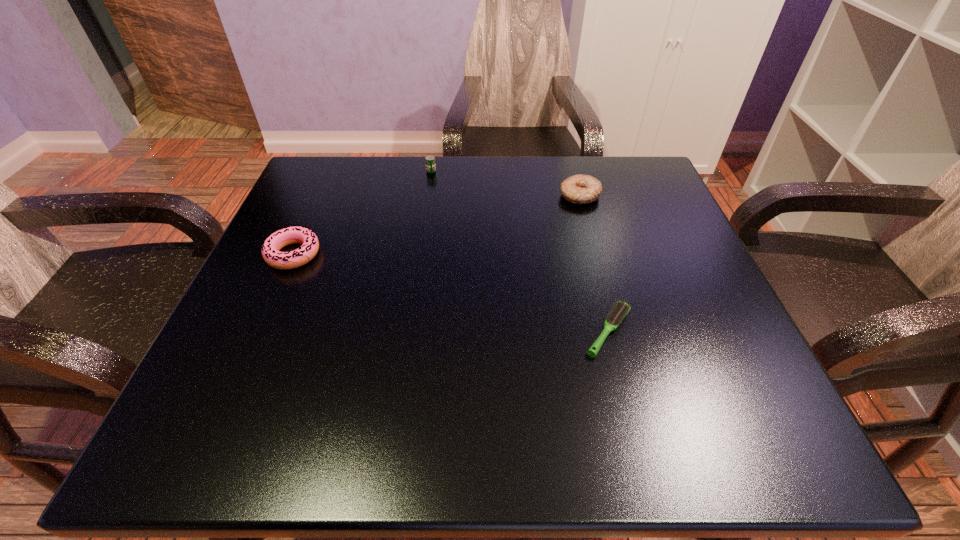
Find the location of a particular element. free point at the near left corner is located at coordinates (291, 424).

Find the location of `vacant space at the far right corner`. vacant space at the far right corner is located at coordinates (654, 186).

At what (x,y) coordinates should I click in order to perform the action: click on free space at the near right corner. Please return your answer as a coordinate pair (x, y). Looking at the image, I should click on (715, 447).

In order to click on free space between the third farthest object and the third object from right to left in this screenshot , I will do `click(362, 213)`.

Where is `vacant region between the right doughnut and the second nearest object`? vacant region between the right doughnut and the second nearest object is located at coordinates (437, 225).

This screenshot has width=960, height=540. Identify the location of vacant area that lies between the right doughnut and the third farthest object. (437, 225).

Identify the location of vacant area between the farther doughnut and the beer can. This screenshot has height=540, width=960. point(506,184).

At what (x,y) coordinates should I click in order to perform the action: click on vacant area that lies between the farther doughnut and the shortest object. Please return your answer as a coordinate pair (x, y). This screenshot has width=960, height=540. Looking at the image, I should click on (594, 264).

I want to click on free spot between the third nearest object and the shortest object, so click(x=594, y=264).

Identify the location of empty space between the hairbrush and the nearer doughnut. Image resolution: width=960 pixels, height=540 pixels. (451, 293).